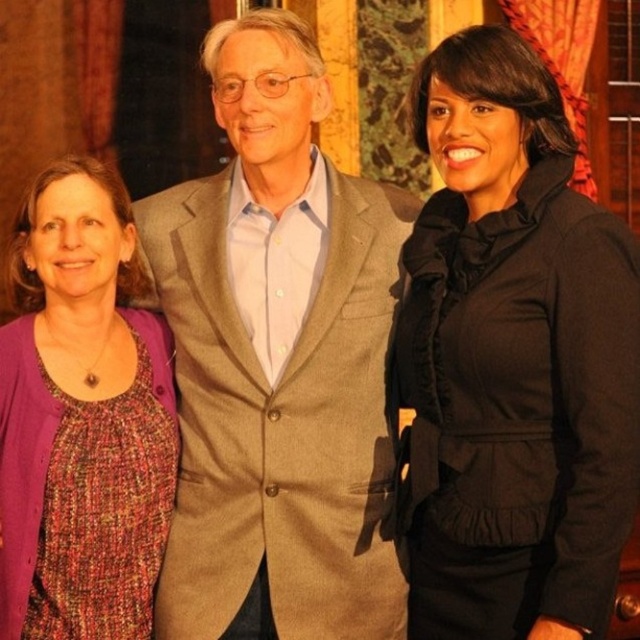
You are organizing a group photo and need to arrange the light brown wool suit at center and the black satin jacket at right so that they fit within a 1.8 meter wide frame. Given their sizes, which one should be placed closer to the edge to ensure both fit?

The black satin jacket at right should be placed closer to the edge since the light brown wool suit at center is wider. This arrangement allows both to fit within the 1.8 meter frame by utilizing the space more efficiently with the narrower jacket near the edge.

You are standing in the room and want to hand a document to the person wearing the black satin jacket at right. Based on their position, where should you approach from to ensure you are facing them directly?

Since the black satin jacket at right is located at point (513, 358), you should approach from the left side to face them directly.